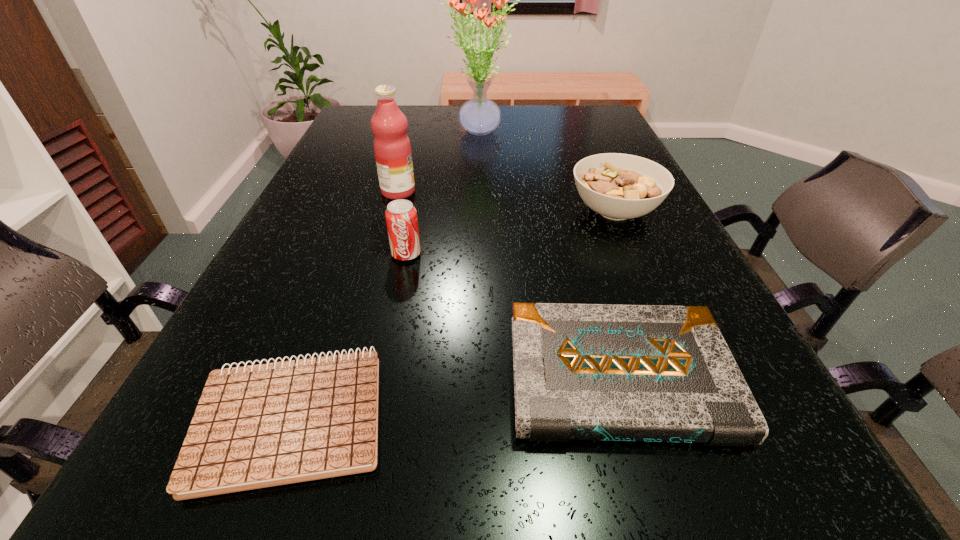
Find the location of a particular element. The height and width of the screenshot is (540, 960). notebook that is positioned at the right edge is located at coordinates point(648,373).

Locate an element on the screen. object that is at the near left corner is located at coordinates (256, 426).

You are a GUI agent. You are given a task and a screenshot of the screen. Output one action in this format:
    pyautogui.click(x=<x>, y=<y>)
    Task: Click on the vacant space at the far edge of the desktop
    
    Given the screenshot: What is the action you would take?
    pyautogui.click(x=444, y=115)

This screenshot has height=540, width=960. In order to click on vacant space at the near edge in this screenshot , I will do `click(398, 512)`.

Locate an element on the screen. vacant space at the left edge is located at coordinates (296, 208).

Image resolution: width=960 pixels, height=540 pixels. In the image, there is a desktop. Find the location of `vacant space at the right edge`. vacant space at the right edge is located at coordinates (759, 453).

Locate an element on the screen. This screenshot has width=960, height=540. blank space at the far left corner of the desktop is located at coordinates (358, 113).

Where is `vacant space at the far right corner of the desktop`? Image resolution: width=960 pixels, height=540 pixels. vacant space at the far right corner of the desktop is located at coordinates (599, 105).

What are the coordinates of `free point between the fifth shortest object and the tallest object` in the screenshot? It's located at click(439, 162).

Locate an element on the screen. This screenshot has width=960, height=540. blank region between the stew and the tallest object is located at coordinates point(546,172).